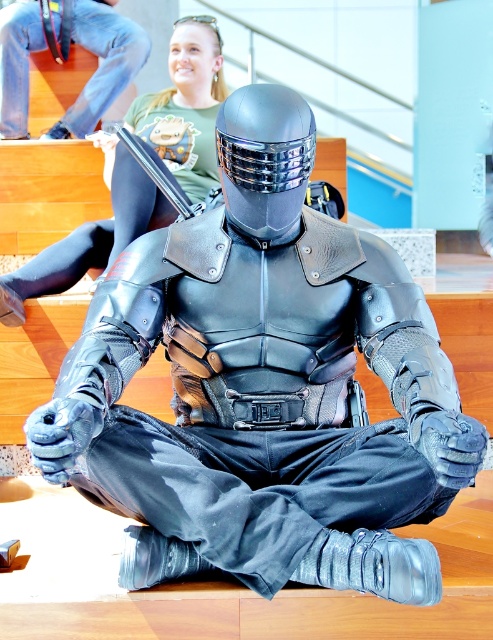
Between green t-shirt at upper center and matte black armor at center, which one appears on the right side from the viewer's perspective?

green t-shirt at upper center is more to the right.

Can you confirm if green t-shirt at upper center is thinner than matte black armor at center?

Incorrect, green t-shirt at upper center's width is not less than matte black armor at center's.

Locate an element on the screen. Image resolution: width=493 pixels, height=640 pixels. green t-shirt at upper center is located at coordinates (89, 236).